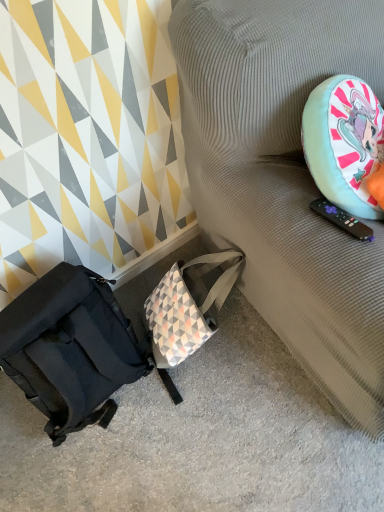
What do you see at coordinates (285, 178) in the screenshot?
I see `textured fabric couch at right` at bounding box center [285, 178].

Identify the location of textured fabric couch at right. (285, 178).

Find the location of a particular element. matte black backpack at lower left is located at coordinates (69, 345).

The height and width of the screenshot is (512, 384). Describe the element at coordinates (69, 345) in the screenshot. I see `matte black backpack at lower left` at that location.

At what (x,y) coordinates should I click in order to perform the action: click on textured fabric couch at right. Please return your answer as a coordinate pair (x, y). The image size is (384, 512). Looking at the image, I should click on (285, 178).

Which object is positioned more to the right, textured fabric couch at right or matte black backpack at lower left?

Positioned to the right is textured fabric couch at right.

Does textured fabric couch at right come in front of matte black backpack at lower left?

Yes, textured fabric couch at right is in front of matte black backpack at lower left.

Which is closer to the camera, (270, 199) or (95, 365)?

Point (270, 199) appears to be closer to the viewer than point (95, 365).

From the image's perspective, which is above, textured fabric couch at right or matte black backpack at lower left?

textured fabric couch at right is shown above in the image.

From the picture: From a real-world perspective, is textured fabric couch at right physically below matte black backpack at lower left?

Actually, textured fabric couch at right is physically above matte black backpack at lower left in the real world.

Looking at their sizes, would you say textured fabric couch at right is wider or thinner than matte black backpack at lower left?

Clearly, textured fabric couch at right has more width compared to matte black backpack at lower left.

Does textured fabric couch at right have a lesser height compared to matte black backpack at lower left?

No, textured fabric couch at right is not shorter than matte black backpack at lower left.

Is textured fabric couch at right bigger or smaller than matte black backpack at lower left?

Considering their sizes, textured fabric couch at right takes up more space than matte black backpack at lower left.

Is matte black backpack at lower left a part of textured fabric couch at right?

Definitely not — matte black backpack at lower left is not inside textured fabric couch at right.

Is textured fabric couch at right in contact with matte black backpack at lower left?

No, textured fabric couch at right is not touching matte black backpack at lower left.

Is textured fabric couch at right oriented away from matte black backpack at lower left?

No, textured fabric couch at right is not facing the opposite direction of matte black backpack at lower left.

In the image, there is a textured fabric couch at right. Where is `luggage and bags below it (from a real-world perspective)`? luggage and bags below it (from a real-world perspective) is located at coordinates (69, 345).

Is matte black backpack at lower left to the right of textured fabric couch at right from the viewer's perspective?

No.

Relative to textured fabric couch at right, is matte black backpack at lower left in front or behind?

In the image, matte black backpack at lower left appears behind textured fabric couch at right.

Which is closer, (103, 331) or (246, 146)?

Point (103, 331) is farther from the camera than point (246, 146).

From the image's perspective, which one is positioned higher, matte black backpack at lower left or textured fabric couch at right?

textured fabric couch at right, from the image's perspective.

From a real-world perspective, who is located higher, matte black backpack at lower left or textured fabric couch at right?

In real-world perspective, textured fabric couch at right is above.

Considering the relative sizes of matte black backpack at lower left and textured fabric couch at right in the image provided, is matte black backpack at lower left thinner than textured fabric couch at right?

Correct, the width of matte black backpack at lower left is less than that of textured fabric couch at right.

Which of these two, matte black backpack at lower left or textured fabric couch at right, stands shorter?

Standing shorter between the two is matte black backpack at lower left.

Is matte black backpack at lower left smaller than textured fabric couch at right?

Correct, matte black backpack at lower left occupies less space than textured fabric couch at right.

Is matte black backpack at lower left completely or partially outside of textured fabric couch at right?

matte black backpack at lower left is positioned outside textured fabric couch at right.

Are matte black backpack at lower left and textured fabric couch at right making contact?

They are not placed beside each other.

Is matte black backpack at lower left aimed at textured fabric couch at right?

No.

Where is `luggage and bags on the left side of textured fabric couch at right`? Image resolution: width=384 pixels, height=512 pixels. luggage and bags on the left side of textured fabric couch at right is located at coordinates click(x=69, y=345).

Where is `luggage and bags behind the textured fabric couch at right`? luggage and bags behind the textured fabric couch at right is located at coordinates (69, 345).

There is a matte black backpack at lower left. Identify the location of furniture above it (from a real-world perspective). The width and height of the screenshot is (384, 512). (285, 178).